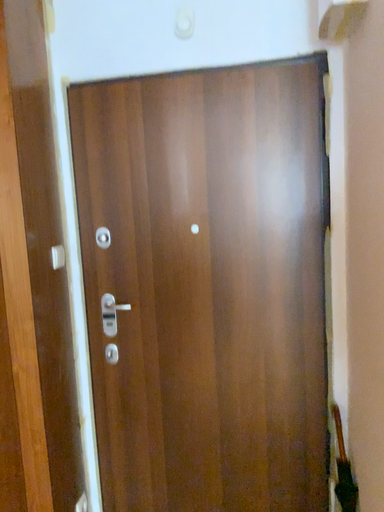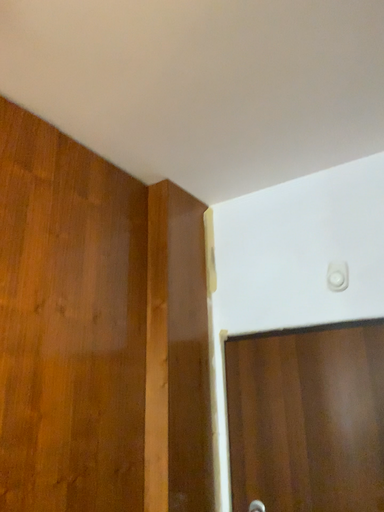
Question: How did the camera likely rotate when shooting the video?

Choices:
 (A) rotated right
 (B) rotated left

Answer: (B)